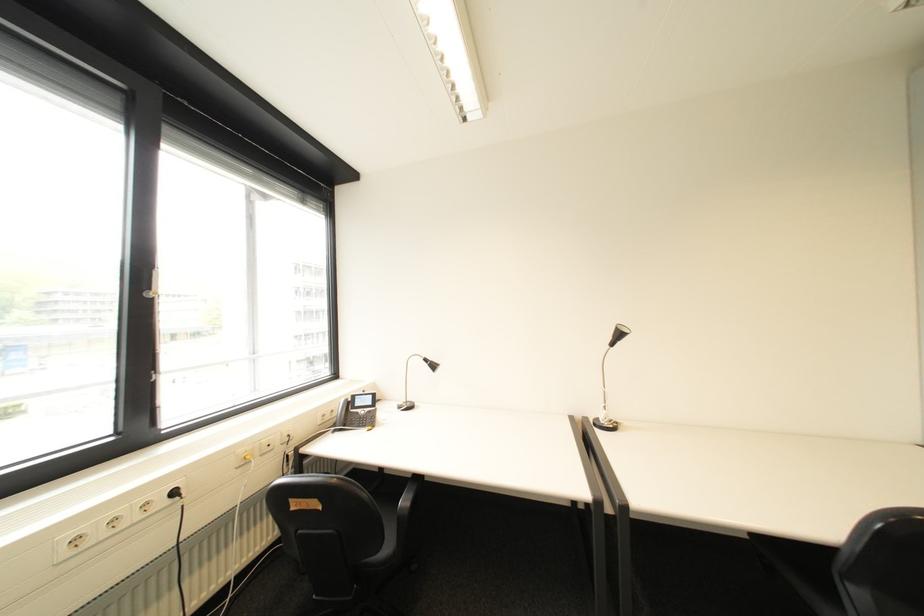
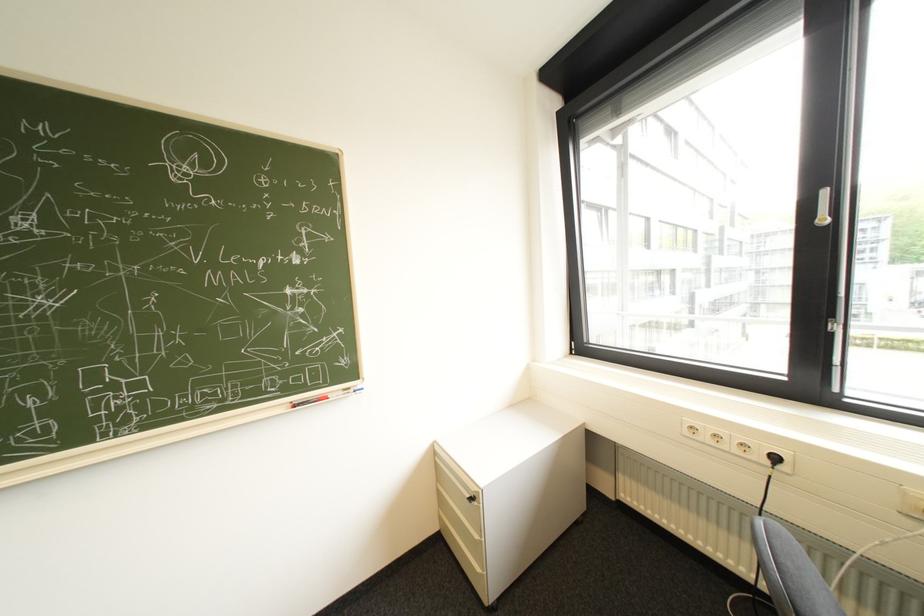
Where in the second image is the point corresponding to point 178,503 from the first image?

(779, 463)